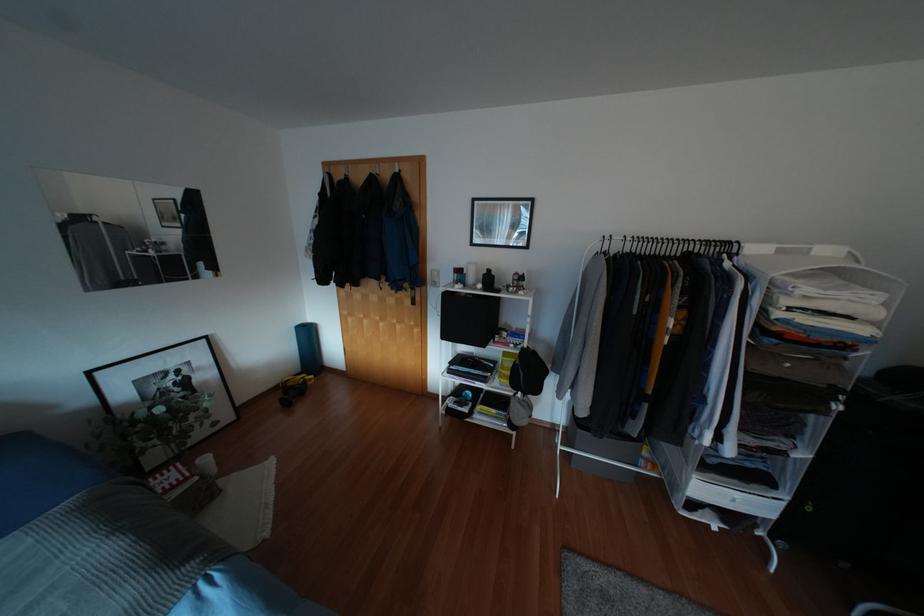
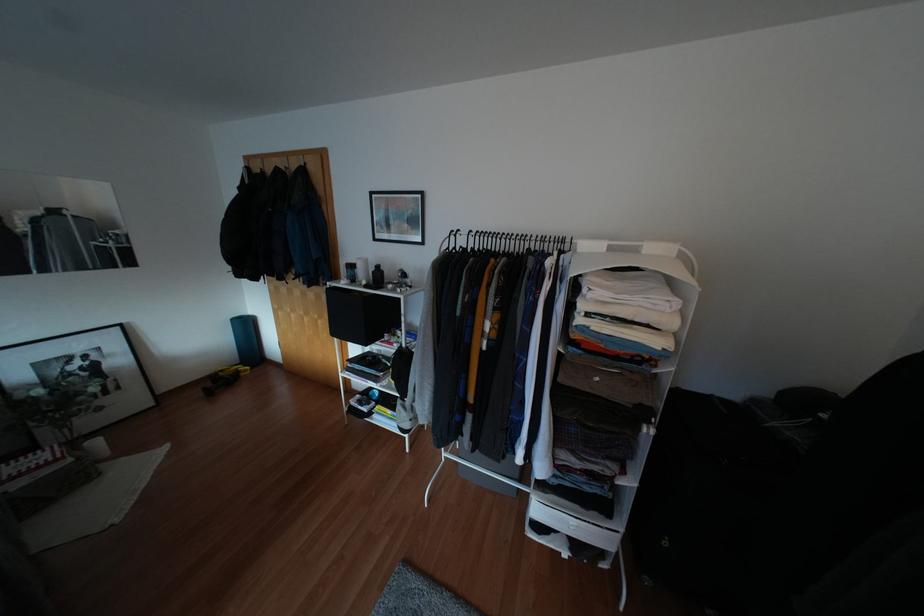
Locate, in the second image, the point that corresponds to the point at 307,333 in the first image.

(246, 325)